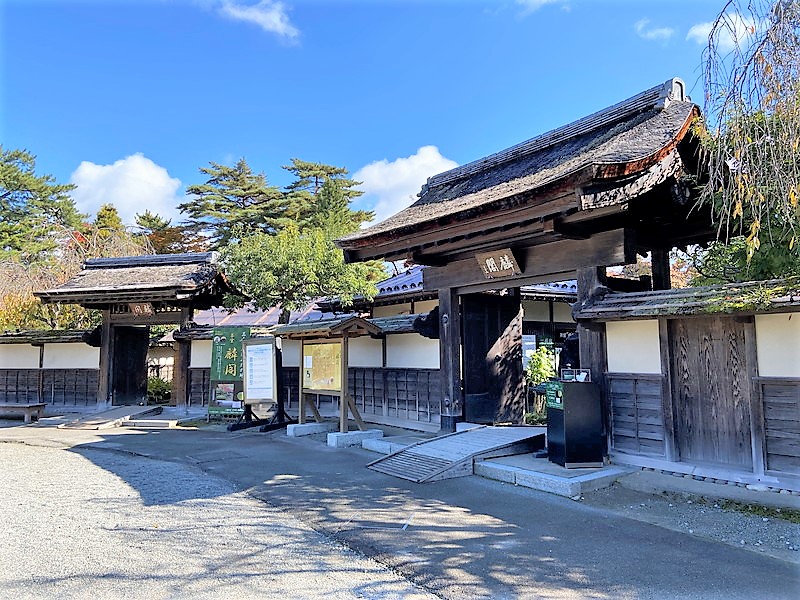
Image resolution: width=800 pixels, height=600 pixels. I want to click on wooden section of walls, so click(785, 417), click(638, 415), click(698, 421), click(404, 396), click(370, 392), click(78, 389), click(198, 386), click(22, 385).